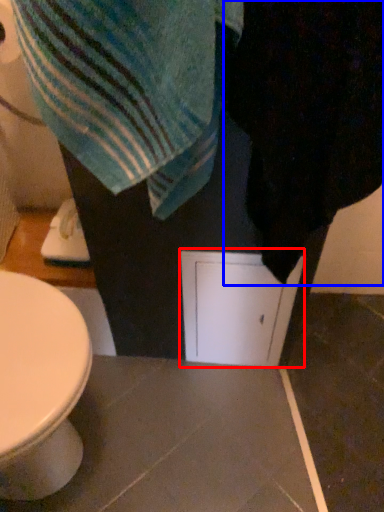
Question: Among these objects, which one is nearest to the camera, screen door (highlighted by a red box) or bath towel (highlighted by a blue box)?

Choices:
 (A) screen door
 (B) bath towel

Answer: (B)